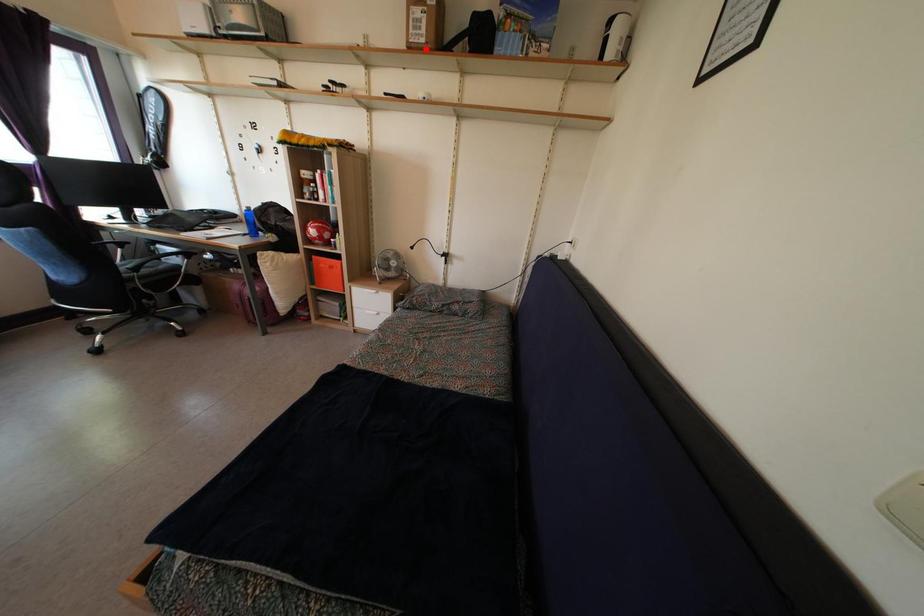
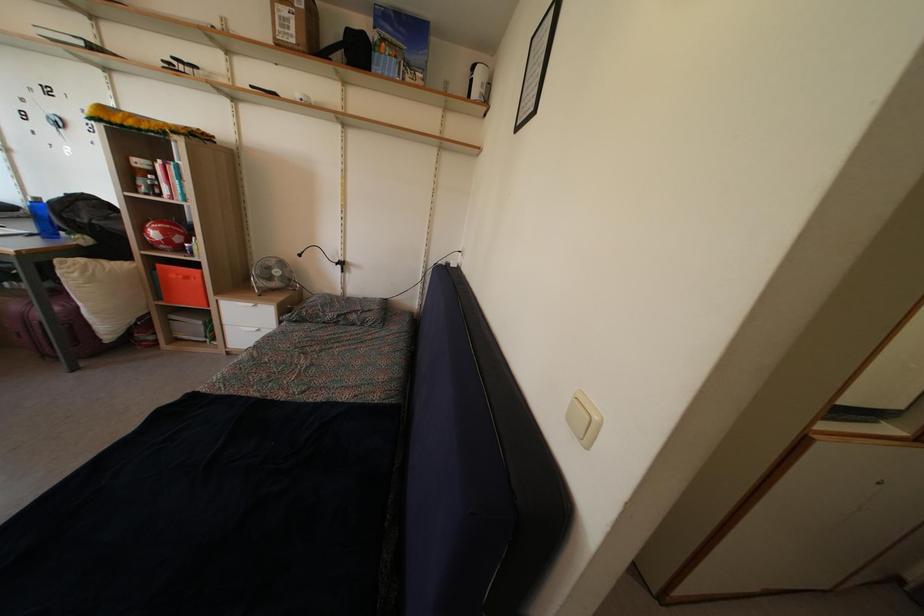
Locate, in the second image, the point that corresponds to the highlighted location in the first image.

(296, 50)